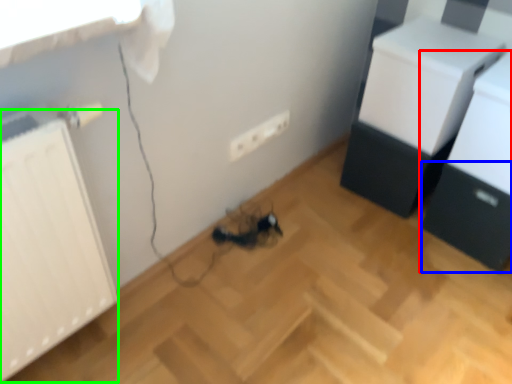
Question: Which object is the closest to the furniture (highlighted by a red box)? Choose among these: drawer (highlighted by a blue box) or radiator (highlighted by a green box).

Choices:
 (A) drawer
 (B) radiator

Answer: (A)